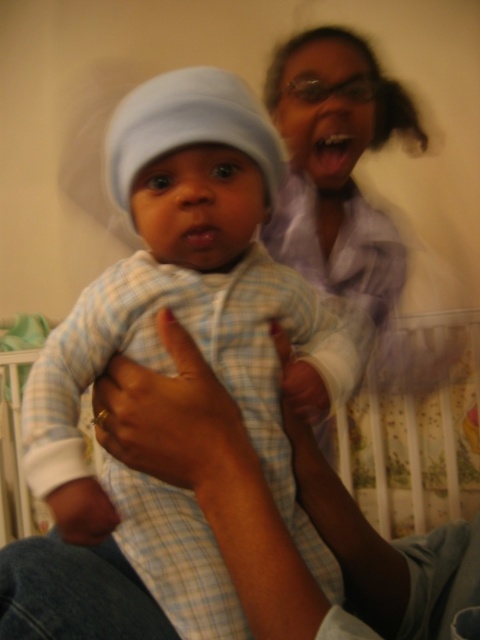
Question: Can you confirm if light blue plaid onesie at center is thinner than light blue plaid fabric at center?

Choices:
 (A) yes
 (B) no

Answer: (A)

Question: Is light blue plaid onesie at center bigger than light blue plaid fabric at center?

Choices:
 (A) no
 (B) yes

Answer: (A)

Question: Does light blue plaid onesie at center appear over light blue plaid fabric at center?

Choices:
 (A) no
 (B) yes

Answer: (B)

Question: Which point is farther from the camera taking this photo?

Choices:
 (A) (317, 310)
 (B) (406, 317)

Answer: (B)

Question: Which of the following is the closest to the observer?

Choices:
 (A) light blue plaid onesie at center
 (B) light blue plaid fabric at center

Answer: (A)